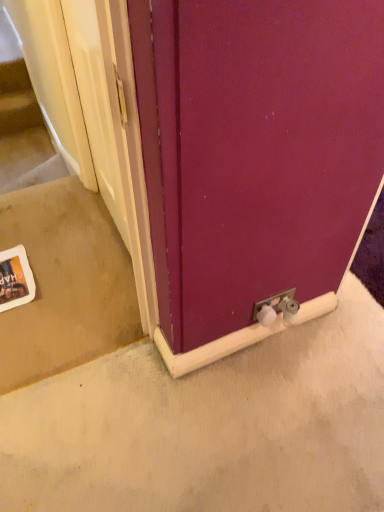
At what (x,y) coordinates should I click in order to perform the action: click on beige carpet at lower left. Please return your answer as a coordinate pair (x, y). The image size is (384, 512). Looking at the image, I should click on (65, 283).

Describe the element at coordinates (65, 283) in the screenshot. This screenshot has height=512, width=384. I see `beige carpet at lower left` at that location.

Identify the location of beige carpet at lower left. (65, 283).